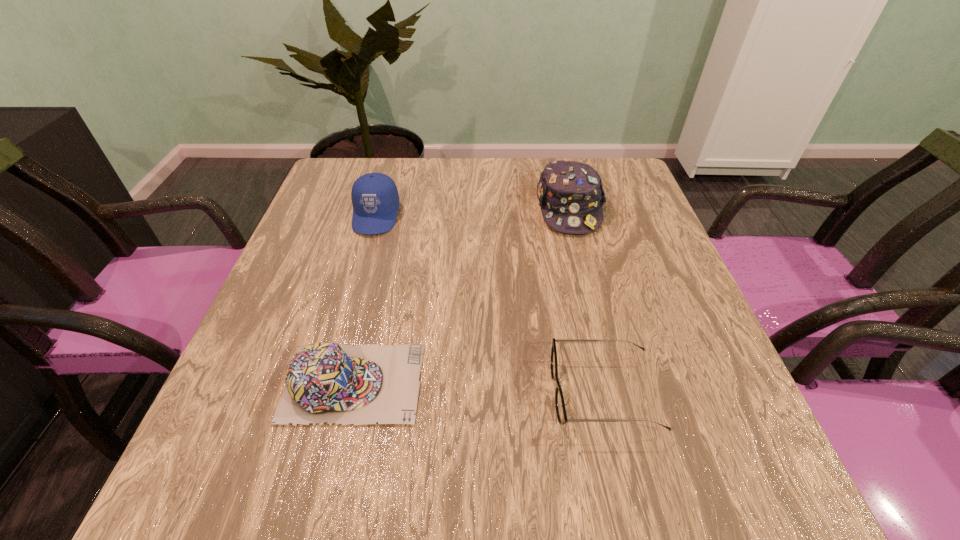
In order to click on free point that satisfies the following two spatial constraints: 1. on the front-facing side of the rightmost cap; 2. on the front, side, and top of the nearest cap in this screenshot , I will do `click(612, 383)`.

The image size is (960, 540). I want to click on vacant space that satisfies the following two spatial constraints: 1. on the front-facing side of the rightmost cap; 2. on the front, side, and top of the nearest cap, so click(x=612, y=383).